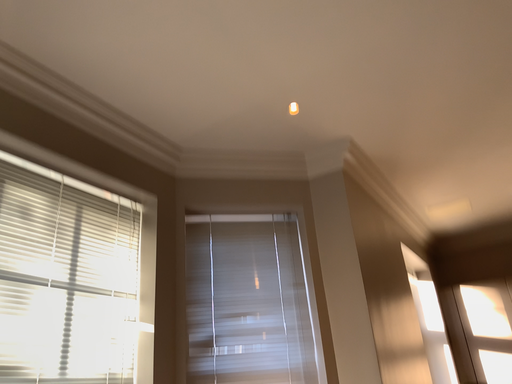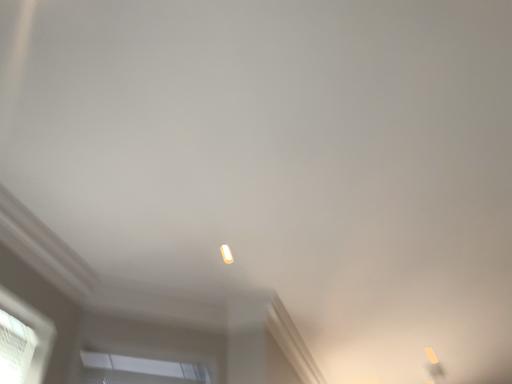
Question: How did the camera likely rotate when shooting the video?

Choices:
 (A) rotated right
 (B) rotated left

Answer: (A)